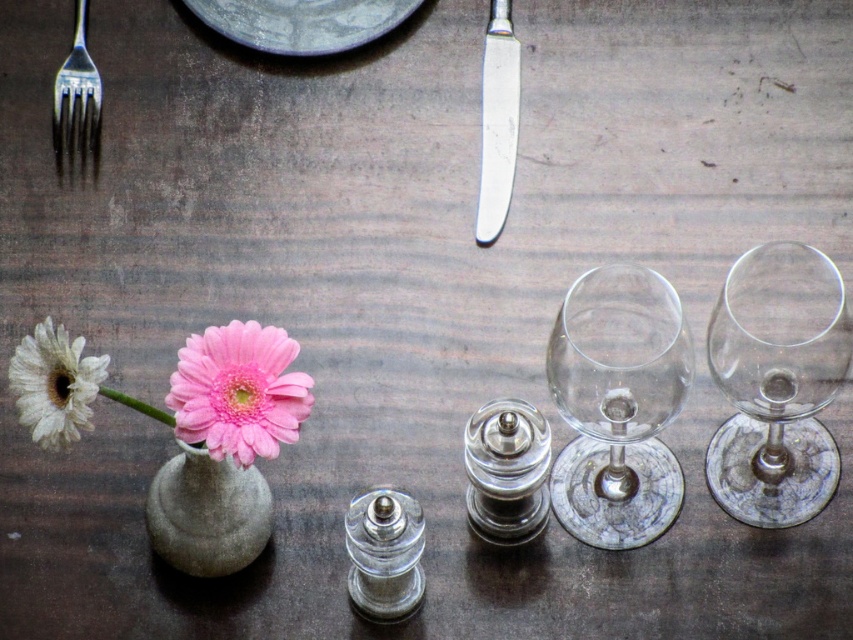
You are looking at the table setting from above and want to place a napkin between the two points marked as point [815,348] and point [323,19]. Which point should you place the napkin closer to so that it appears larger in the image?

You should place the napkin closer to point [815,348] because it is closer to the camera, making objects placed there appear larger in the image.

You are a server at a restaurant and need to place a 24 inch long platter on the table. The platter must be placed between the transparent glass wine glass at right and the edge of the table. Is there enough space for the platter?

The transparent glass wine glass at right is 23.74 inches away from the camera. Since the platter is 24 inches long, there is just enough space to place it between the glass and the table edge, but it will be very tight.

Consider the image. You are setting up a table for a dinner party and need to place a napkin between the silver metallic knife at upper center and the silver metallic fork at upper left. Based on their positions, where should you place the napkin?

The silver metallic knife at upper center is closer to the viewer than the silver metallic fork at upper left, so the napkin should be placed between them in the space closer to the knife to maintain proper placement.